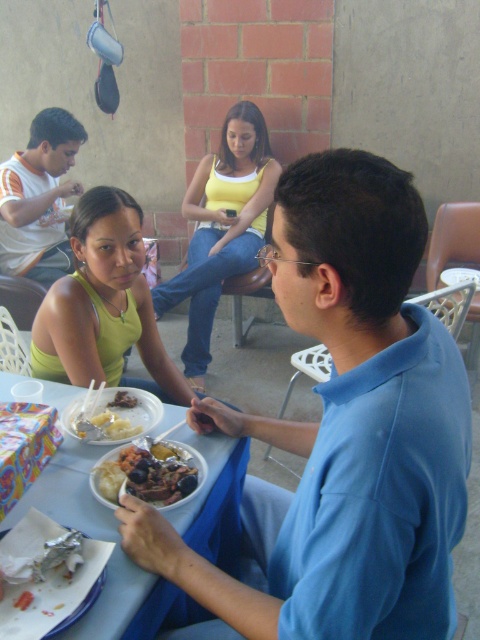
Between point (171, 289) and point (175, 456), which one is positioned in front?

Positioned in front is point (175, 456).

Measure the distance between point (x=199, y=252) and camera.

They are 10.15 feet apart.

I want to click on yellow cotton tank top at center, so click(x=220, y=227).

Does white-orange t-shirt at left have a lesser width compared to shiny metallic bowl at center?

In fact, white-orange t-shirt at left might be wider than shiny metallic bowl at center.

Which is behind, point (51, 129) or point (93, 486)?

The point (51, 129) is behind.

The height and width of the screenshot is (640, 480). Find the location of `white-orange t-shirt at left`. white-orange t-shirt at left is located at coordinates (38, 198).

Is matte yellow tank top at center above white-orange t-shirt at left?

No, matte yellow tank top at center is not above white-orange t-shirt at left.

You are a GUI agent. You are given a task and a screenshot of the screen. Output one action in this format:
    pyautogui.click(x=<x>, y=<y>)
    Task: Click on the matte yellow tank top at center
    The image size is (480, 640).
    Given the screenshot: What is the action you would take?
    pyautogui.click(x=103, y=304)

The width and height of the screenshot is (480, 640). What are the coordinates of `matte yellow tank top at center` in the screenshot? It's located at (103, 304).

Identify the location of matte yellow tank top at center. (103, 304).